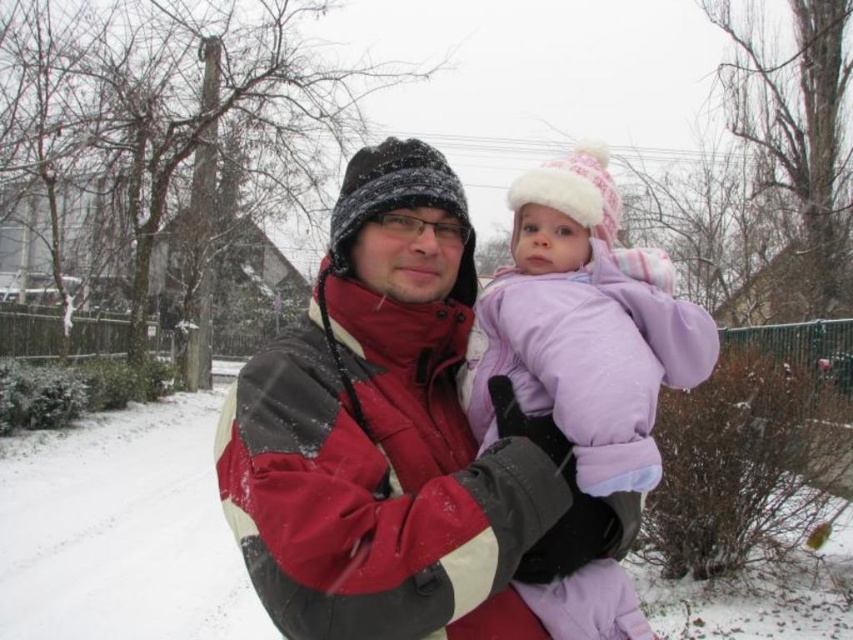
Can you confirm if matte red jacket at center is taller than purple fleece snowsuit at center?

In fact, matte red jacket at center may be shorter than purple fleece snowsuit at center.

Between point (433, 244) and point (660, 326), which one is positioned in front?

Point (660, 326)

At what (x,y) coordinates should I click in order to perform the action: click on matte red jacket at center. Please return your answer as a coordinate pair (x, y). This screenshot has height=640, width=853. Looking at the image, I should click on (390, 436).